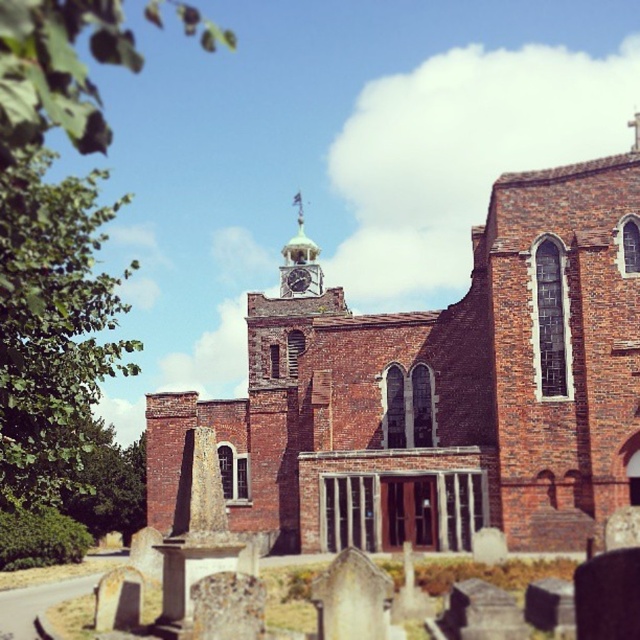
Question: Which point is farther from the camera taking this photo?

Choices:
 (A) (285, 268)
 (B) (618, 412)

Answer: (A)

Question: Which point is closer to the camera taking this photo?

Choices:
 (A) (292, 264)
 (B) (346, 372)

Answer: (B)

Question: Where is green painted metal clock tower at upper center located in relation to matte black clock at center in the image?

Choices:
 (A) right
 (B) left

Answer: (B)

Question: Can you confirm if brick church at center is positioned to the left of green painted metal clock tower at upper center?

Choices:
 (A) yes
 (B) no

Answer: (B)

Question: Which object is positioned farthest from the brick church at center?

Choices:
 (A) green painted metal clock tower at upper center
 (B) matte black clock at center

Answer: (A)

Question: Is brick church at center positioned in front of matte black clock at center?

Choices:
 (A) no
 (B) yes

Answer: (B)